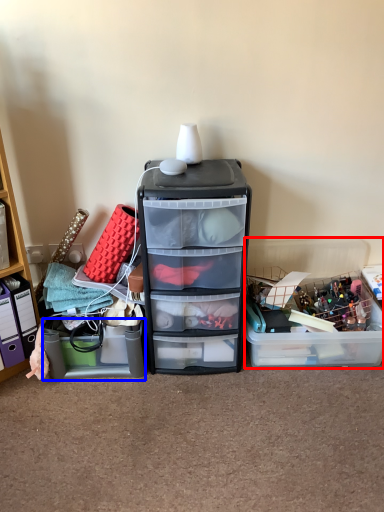
Question: Among these objects, which one is nearest to the camera, storage box (highlighted by a red box) or storage box (highlighted by a blue box)?

Choices:
 (A) storage box
 (B) storage box

Answer: (B)